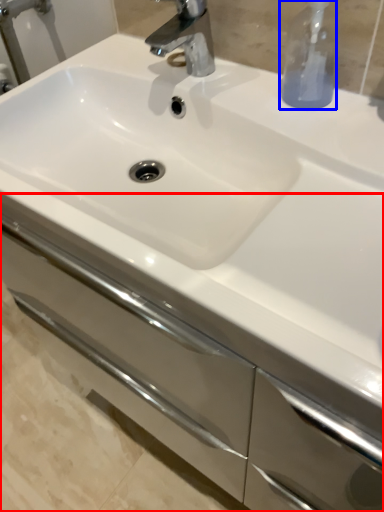
Question: Which object is closer to the camera taking this photo, bathroom cabinet (highlighted by a red box) or soap dispenser (highlighted by a blue box)?

Choices:
 (A) bathroom cabinet
 (B) soap dispenser

Answer: (A)